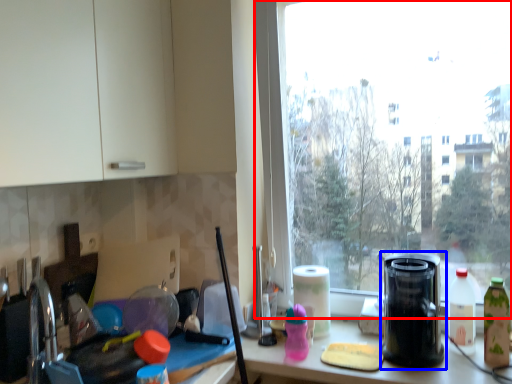
Question: Which object is closer to the camera taking this photo, window (highlighted by a red box) or kitchen appliance (highlighted by a blue box)?

Choices:
 (A) window
 (B) kitchen appliance

Answer: (B)